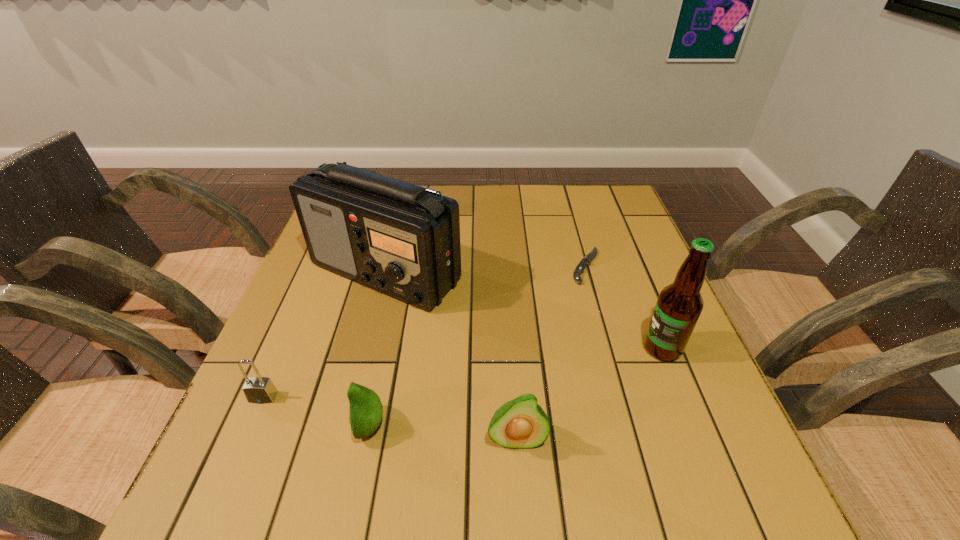
Find the location of a particular element. The height and width of the screenshot is (540, 960). beer bottle that is at the right edge is located at coordinates (679, 305).

Find the location of a particular element. This screenshot has height=540, width=960. pocketknife present at the right edge is located at coordinates (587, 259).

Locate an element on the screen. This screenshot has height=540, width=960. free location at the far edge is located at coordinates (533, 226).

The height and width of the screenshot is (540, 960). In the image, there is a desktop. Find the location of `vacant space at the near edge`. vacant space at the near edge is located at coordinates (396, 423).

In the image, there is a desktop. Where is `blank space at the right edge`? blank space at the right edge is located at coordinates (652, 259).

You are a GUI agent. You are given a task and a screenshot of the screen. Output one action in this format:
    pyautogui.click(x=<x>, y=<y>)
    Task: Click on the free space at the near left corner
    This screenshot has height=540, width=960.
    Given the screenshot: What is the action you would take?
    pyautogui.click(x=283, y=413)

What are the coordinates of `vacant space at the far right corner` in the screenshot? It's located at (618, 226).

At what (x,y) coordinates should I click in order to perform the action: click on free space between the right avocado and the pocketknife. Please return your answer as a coordinate pair (x, y). Looking at the image, I should click on (551, 353).

I want to click on empty space that is in between the beer bottle and the left avocado, so click(516, 387).

Where is `vacant space that's between the pocketknife and the third nearest object`? vacant space that's between the pocketknife and the third nearest object is located at coordinates (424, 332).